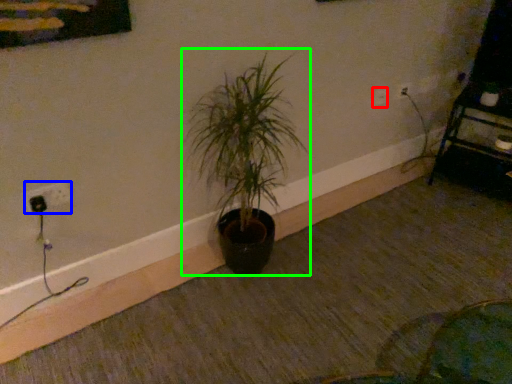
Question: Which is nearer to the electric outlet (highlighted by a red box)? electric outlet (highlighted by a blue box) or houseplant (highlighted by a green box).

Choices:
 (A) electric outlet
 (B) houseplant

Answer: (B)